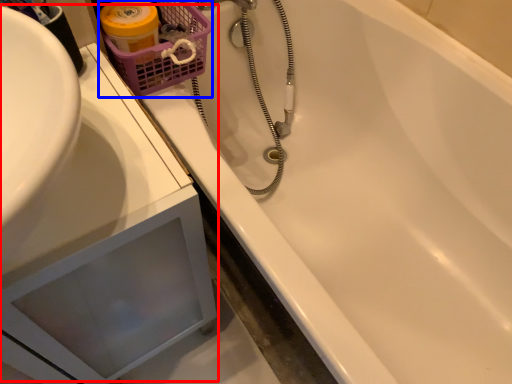
Question: Among these objects, which one is nearest to the camera, sink (highlighted by a red box) or basket (highlighted by a blue box)?

Choices:
 (A) sink
 (B) basket

Answer: (A)